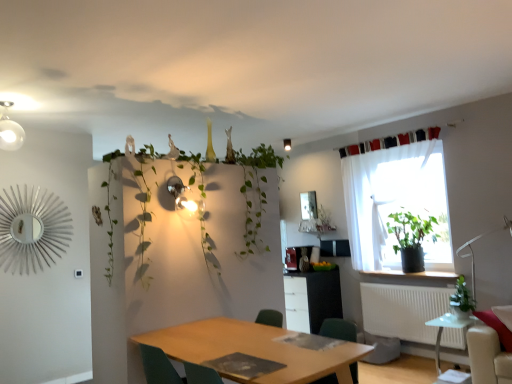
Question: Considering the positions of point (168, 372) and point (436, 362), is point (168, 372) closer or farther from the camera than point (436, 362)?

Choices:
 (A) farther
 (B) closer

Answer: (B)

Question: From the image's perspective, is green fabric chair at lower center positioned above or below transparent glass table at lower right, the 2th table when ordered from front to back?

Choices:
 (A) below
 (B) above

Answer: (B)

Question: Which object is positioned farthest from the white sheer curtain at upper right?

Choices:
 (A) green leafy plant at upper center
 (B) white glossy cabinet at center
 (C) black fabric curtain at upper right
 (D) green fabric chair at lower center
 (E) wooden table at center, arranged as the 2th table when viewed from the back

Answer: (D)

Question: Estimate the real-world distances between objects in this image. Which object is closer to the transparent glass table at lower right, the 1th table from the back?

Choices:
 (A) black fabric curtain at upper right
 (B) green leafy plant at upper center
 (C) matte white light fixture at upper center
 (D) white plastic radiator at lower right
 (E) green fabric chair at lower center

Answer: (D)